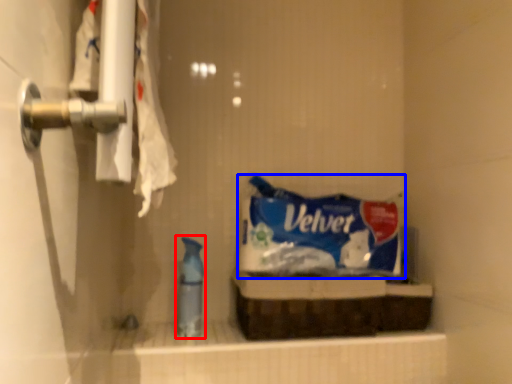
Question: Which object is further to the camera taking this photo, cleaning product (highlighted by a red box) or snack (highlighted by a blue box)?

Choices:
 (A) cleaning product
 (B) snack

Answer: (B)